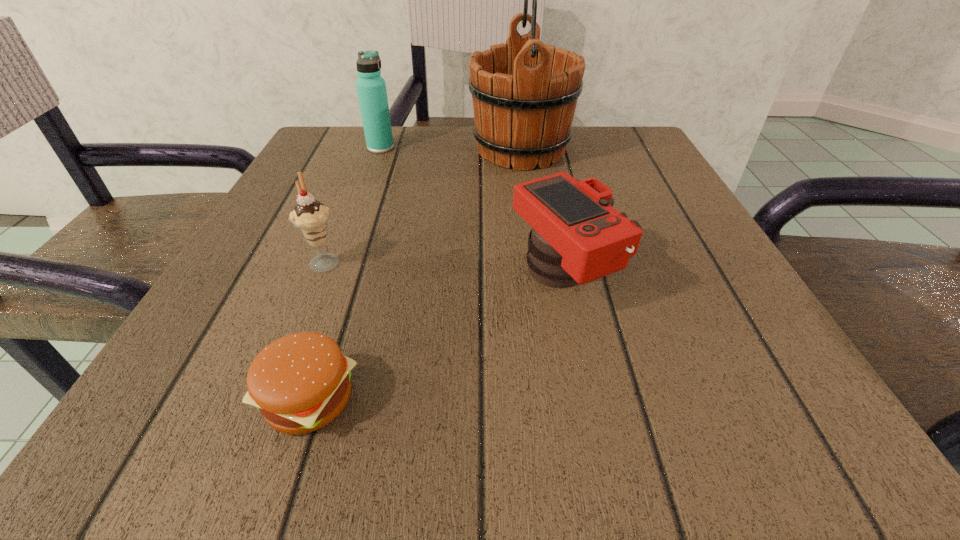
Where is `vacant space located on the back of the nearest object`? The width and height of the screenshot is (960, 540). vacant space located on the back of the nearest object is located at coordinates coord(364,231).

Where is `wine bucket that is at the far edge`? The image size is (960, 540). wine bucket that is at the far edge is located at coordinates (524, 92).

Where is `thermos bottle situated at the far edge`? This screenshot has width=960, height=540. thermos bottle situated at the far edge is located at coordinates (371, 88).

Where is `object that is positioned at the near edge`? This screenshot has height=540, width=960. object that is positioned at the near edge is located at coordinates (300, 382).

Where is `thermos bottle at the left edge`? The image size is (960, 540). thermos bottle at the left edge is located at coordinates (371, 88).

The width and height of the screenshot is (960, 540). Find the location of `icecream at the left edge`. icecream at the left edge is located at coordinates (311, 217).

Where is `hamburger positioned at the left edge`? The width and height of the screenshot is (960, 540). hamburger positioned at the left edge is located at coordinates (300, 382).

Locate an element on the screen. Image resolution: width=960 pixels, height=540 pixels. object present at the far left corner is located at coordinates (371, 88).

At what (x,y) coordinates should I click in order to perform the action: click on object situated at the near left corner. Please return your answer as a coordinate pair (x, y). The width and height of the screenshot is (960, 540). Looking at the image, I should click on (300, 382).

This screenshot has height=540, width=960. What are the coordinates of `vacant space at the far edge` in the screenshot? It's located at (459, 127).